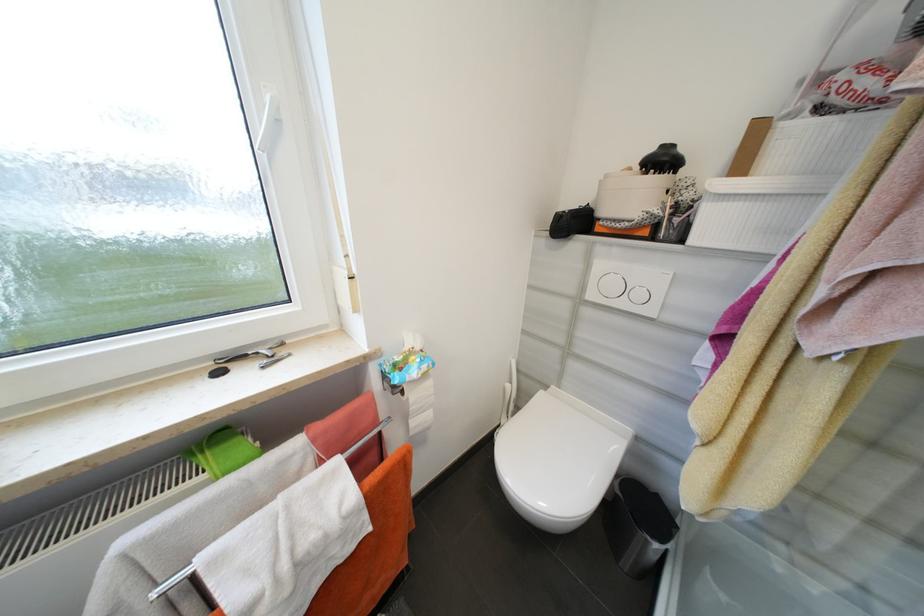
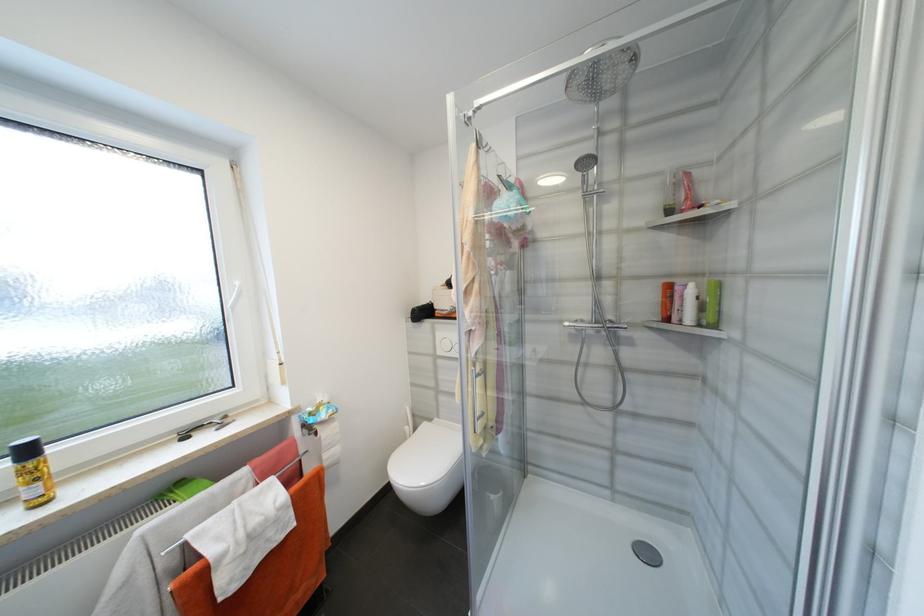
Where in the second image is the point corresponding to point (407, 392) from the first image?

(322, 435)